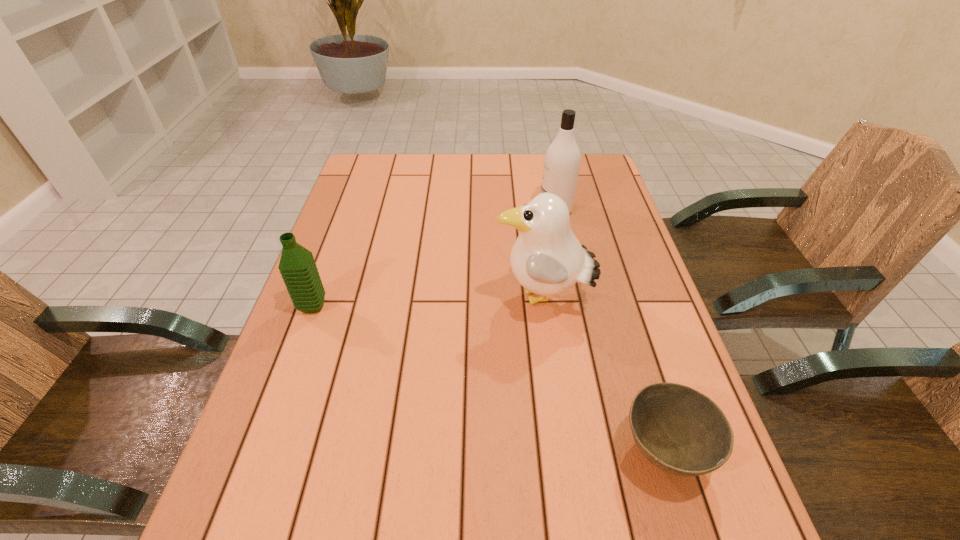
Find the location of a particular element. This screenshot has width=960, height=540. blank space located on the beak of the gull is located at coordinates (465, 299).

The width and height of the screenshot is (960, 540). In order to click on vacant space located 0.170m on the beak of the gull in this screenshot , I will do `click(423, 299)`.

I want to click on vacant space located on the right of the third tallest object, so click(x=348, y=306).

Where is `vacant space located on the left of the bowl`? This screenshot has height=540, width=960. vacant space located on the left of the bowl is located at coordinates pos(472,451).

At what (x,y) coordinates should I click in order to perform the action: click on object present at the left edge. Please return your answer as a coordinate pair (x, y). Looking at the image, I should click on (297, 266).

I want to click on shampoo that is at the right edge, so click(x=562, y=159).

Where is `gull present at the right edge`? Image resolution: width=960 pixels, height=540 pixels. gull present at the right edge is located at coordinates (547, 259).

Find the location of a particular element. This screenshot has width=960, height=540. bowl present at the right edge is located at coordinates pos(678,429).

The image size is (960, 540). Find the location of `free space at the far edge`. free space at the far edge is located at coordinates (465, 180).

This screenshot has width=960, height=540. What are the coordinates of `vacant region at the left edge of the desktop` in the screenshot? It's located at (322, 449).